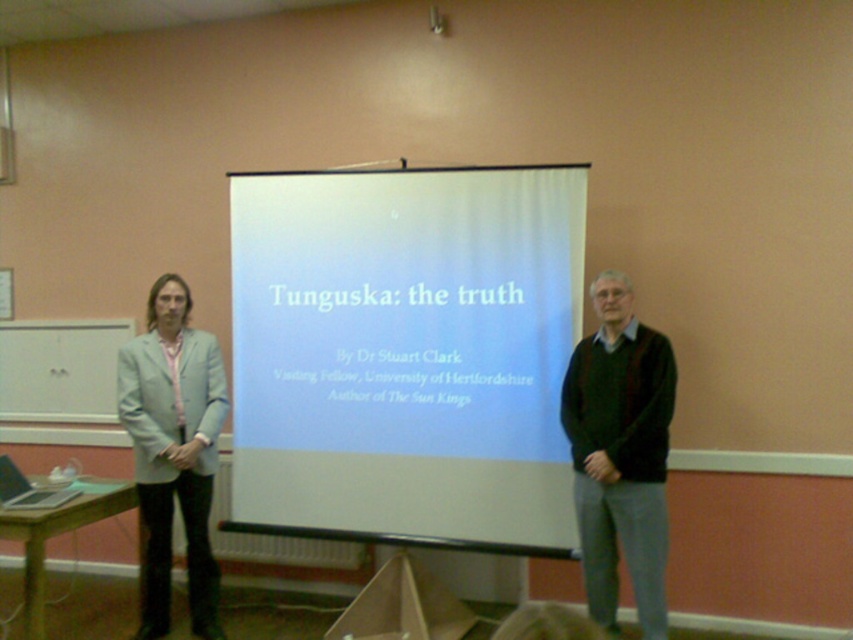
Question: Which point is farther from the camera taking this photo?

Choices:
 (A) (378, 268)
 (B) (193, 424)

Answer: (A)

Question: Does dark green sweater at center appear under light blue fabric jacket at left?

Choices:
 (A) no
 (B) yes

Answer: (A)

Question: Among these points, which one is farthest from the camera?

Choices:
 (A) (212, 474)
 (B) (592, 480)

Answer: (A)

Question: Does white matte projection screen at center appear on the right side of light blue fabric jacket at left?

Choices:
 (A) yes
 (B) no

Answer: (A)

Question: Does white matte projection screen at center lie behind dark green sweater at center?

Choices:
 (A) no
 (B) yes

Answer: (B)

Question: Which object is positioned farthest from the white matte projection screen at center?

Choices:
 (A) dark green sweater at center
 (B) light blue fabric jacket at left

Answer: (B)